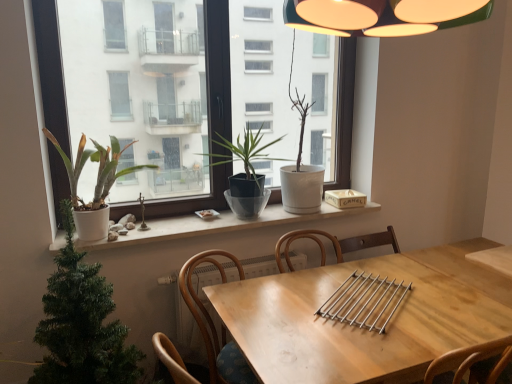
Locate an element on the screen. The height and width of the screenshot is (384, 512). wooden at center is located at coordinates (214, 325).

Describe the element at coordinates (214, 325) in the screenshot. The height and width of the screenshot is (384, 512). I see `wooden at center` at that location.

What do you see at coordinates (301, 172) in the screenshot?
I see `white matte pot at center, which appears as the first houseplant when viewed from the right` at bounding box center [301, 172].

At what (x,y) coordinates should I click in order to perform the action: click on green matte christmas tree at lower left, acting as the third houseplant starting from the right. Please return your answer as a coordinate pair (x, y). Looking at the image, I should click on (82, 324).

Measure the distance between point (257,304) and camera.

A distance of 5.65 feet exists between point (257,304) and camera.

Where is `matte white window at center`? The height and width of the screenshot is (384, 512). matte white window at center is located at coordinates (50, 69).

Identify the location of table directly beneath the white matte pot at left, marked as the fourth houseplant in a right-to-left arrangement (from a real-world perspective). This screenshot has width=512, height=384. (366, 330).

From a real-world perspective, is white matte pot at left, marked as the fourth houseplant in a right-to-left arrangement, positioned above or below wooden table at center?

In terms of real-world spatial position, white matte pot at left, marked as the fourth houseplant in a right-to-left arrangement, is above wooden table at center.

Considering the sizes of objects white matte pot at left, the first houseplant viewed from the left, and wooden table at center in the image provided, who is wider, white matte pot at left, the first houseplant viewed from the left, or wooden table at center?

wooden table at center.

Between wooden at center and matte white window at center, which one has less height?

wooden at center is shorter.

From the image's perspective, is wooden at center above or below matte white window at center?

Based on their image positions, wooden at center is located beneath matte white window at center.

Identify the location of chair beneath the matte white window at center (from a real-world perspective). Image resolution: width=512 pixels, height=384 pixels. (214, 325).

Is wooden at center not within matte white window at center?

That's correct, wooden at center is outside of matte white window at center.

Would you consider white matte pot at center, which is counted as the 4th houseplant, starting from the left, to be distant from white matte window sill at center?

They are positioned close to each other.

Considering the sizes of white matte pot at center, which appears as the first houseplant when viewed from the right, and white matte window sill at center in the image, is white matte pot at center, which appears as the first houseplant when viewed from the right, taller or shorter than white matte window sill at center?

Clearly, white matte pot at center, which appears as the first houseplant when viewed from the right, is taller compared to white matte window sill at center.

In the scene shown: Considering the sizes of objects white matte pot at center, which appears as the first houseplant when viewed from the right, and white matte window sill at center in the image provided, who is smaller, white matte pot at center, which appears as the first houseplant when viewed from the right, or white matte window sill at center?

white matte window sill at center.

Between point (66, 115) and point (242, 151), which one is positioned behind?

The point (242, 151) is farther.

Can you tell me how much matte white window at center and matte gray pot at center, the 3th houseplant viewed from the left, differ in facing direction?

The angle between the facing direction of matte white window at center and the facing direction of matte gray pot at center, the 3th houseplant viewed from the left, is 0.0814 degrees.

In the scene shown: Would you say matte gray pot at center, the 3th houseplant viewed from the left, is part of matte white window at center's contents?

No, matte gray pot at center, the 3th houseplant viewed from the left, is not inside matte white window at center.

Which object is thinner, matte white window at center or matte gray pot at center, which is the 2th houseplant in right-to-left order?

matte white window at center is thinner.

Would you say white matte pot at center, which appears as the first houseplant when viewed from the right, is inside or outside matte white window at center?

white matte pot at center, which appears as the first houseplant when viewed from the right, cannot be found inside matte white window at center.

Considering the relative sizes of white matte pot at center, which is counted as the 4th houseplant, starting from the left, and matte white window at center in the image provided, is white matte pot at center, which is counted as the 4th houseplant, starting from the left, shorter than matte white window at center?

Correct, white matte pot at center, which is counted as the 4th houseplant, starting from the left, is not as tall as matte white window at center.

Based on the photo, between white matte pot at center, which appears as the first houseplant when viewed from the right, and matte white window at center, which one appears on the right side from the viewer's perspective?

white matte pot at center, which appears as the first houseplant when viewed from the right, is more to the right.

Is white matte pot at center, which is counted as the 4th houseplant, starting from the left, oriented away from matte white window at center?

Correct, white matte pot at center, which is counted as the 4th houseplant, starting from the left, is looking away from matte white window at center.

From a real-world perspective, who is located higher, wooden at center or green matte christmas tree at lower left, the second houseplant from the left?

green matte christmas tree at lower left, the second houseplant from the left, from a real-world perspective.

Is green matte christmas tree at lower left, acting as the third houseplant starting from the right, completely or partially inside wooden at center?

Actually, green matte christmas tree at lower left, acting as the third houseplant starting from the right, is outside wooden at center.

Is point (236, 380) closer or farther from the camera than point (54, 275)?

Point (236, 380) appears to be farther away from the viewer than point (54, 275).

From the image's perspective, which is below, green matte christmas tree at lower left, acting as the third houseplant starting from the right, or matte gray pot at center, which is the 2th houseplant in right-to-left order?

From the image's view, green matte christmas tree at lower left, acting as the third houseplant starting from the right, is below.

Would you say green matte christmas tree at lower left, the second houseplant from the left, is to the left or to the right of matte gray pot at center, the 3th houseplant viewed from the left, in the picture?

green matte christmas tree at lower left, the second houseplant from the left, is to the left of matte gray pot at center, the 3th houseplant viewed from the left.

How many degrees apart are the facing directions of green matte christmas tree at lower left, acting as the third houseplant starting from the right, and matte gray pot at center, which is the 2th houseplant in right-to-left order?

The angle between the facing direction of green matte christmas tree at lower left, acting as the third houseplant starting from the right, and the facing direction of matte gray pot at center, which is the 2th houseplant in right-to-left order, is 0.332 degrees.

Does point (97, 369) come behind point (257, 140)?

No.

Where is `table that is under the white matte pot at left, marked as the fourth houseplant in a right-to-left arrangement (from a real-world perspective)`? table that is under the white matte pot at left, marked as the fourth houseplant in a right-to-left arrangement (from a real-world perspective) is located at coordinates (366, 330).

Where is `window behind the wooden at center`? Image resolution: width=512 pixels, height=384 pixels. window behind the wooden at center is located at coordinates tap(50, 69).

Which object lies further to the anchor point matte white window at center, white matte pot at left, marked as the fourth houseplant in a right-to-left arrangement, or wooden table at center?

Among the two, wooden table at center is located further to matte white window at center.

When comparing their distances from wooden table at center, does white matte pot at center, which appears as the first houseplant when viewed from the right, or white matte pot at left, the first houseplant viewed from the left, seem closer?

white matte pot at center, which appears as the first houseplant when viewed from the right.

When comparing their distances from matte white window at center, does wooden table at center or green matte christmas tree at lower left, acting as the third houseplant starting from the right, seem further?

Among the two, wooden table at center is located further to matte white window at center.

From the image, which object appears to be farther from wooden table at center, matte white window at center or white matte pot at center, which appears as the first houseplant when viewed from the right?

matte white window at center is positioned further to the anchor wooden table at center.

Considering their positions, is matte gray pot at center, which is the 2th houseplant in right-to-left order, positioned further to white matte pot at left, the first houseplant viewed from the left, than white matte window sill at center?

The object further to white matte pot at left, the first houseplant viewed from the left, is matte gray pot at center, which is the 2th houseplant in right-to-left order.

Based on their spatial positions, is white matte window sill at center or matte white window at center closer to wooden at center?

Among the two, white matte window sill at center is located nearer to wooden at center.

Which object lies nearer to the anchor point wooden table at center, wooden at center or matte white window at center?

The object closer to wooden table at center is wooden at center.

Looking at the image, which one is located further to wooden at center, wooden table at center or white matte pot at center, which is counted as the 4th houseplant, starting from the left?

Based on the image, white matte pot at center, which is counted as the 4th houseplant, starting from the left, appears to be further to wooden at center.

The width and height of the screenshot is (512, 384). I want to click on window sill between green matte christmas tree at lower left, the second houseplant from the left, and matte gray pot at center, the 3th houseplant viewed from the left, in the front-back direction, so click(x=216, y=225).

What are the coordinates of `chair between green matte christmas tree at lower left, the second houseplant from the left, and wooden table at center from left to right` in the screenshot? It's located at (214, 325).

Where is `window between white matte pot at left, the first houseplant viewed from the left, and white matte pot at center, which appears as the first houseplant when viewed from the right, from left to right`? This screenshot has height=384, width=512. window between white matte pot at left, the first houseplant viewed from the left, and white matte pot at center, which appears as the first houseplant when viewed from the right, from left to right is located at coordinates (50, 69).

Where is `window sill located between white matte pot at left, the first houseplant viewed from the left, and wooden table at center in the left-right direction`? window sill located between white matte pot at left, the first houseplant viewed from the left, and wooden table at center in the left-right direction is located at coordinates (216, 225).